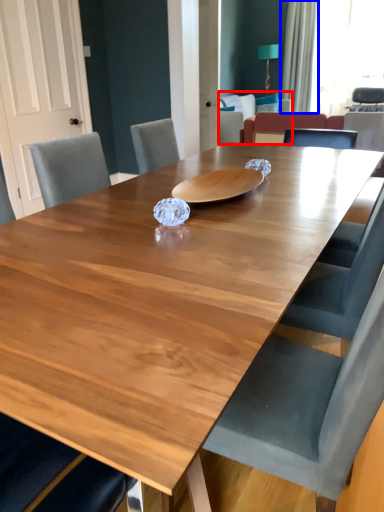
Question: Among these objects, which one is nearest to the camera, armchair (highlighted by a red box) or curtain (highlighted by a blue box)?

Choices:
 (A) armchair
 (B) curtain

Answer: (A)